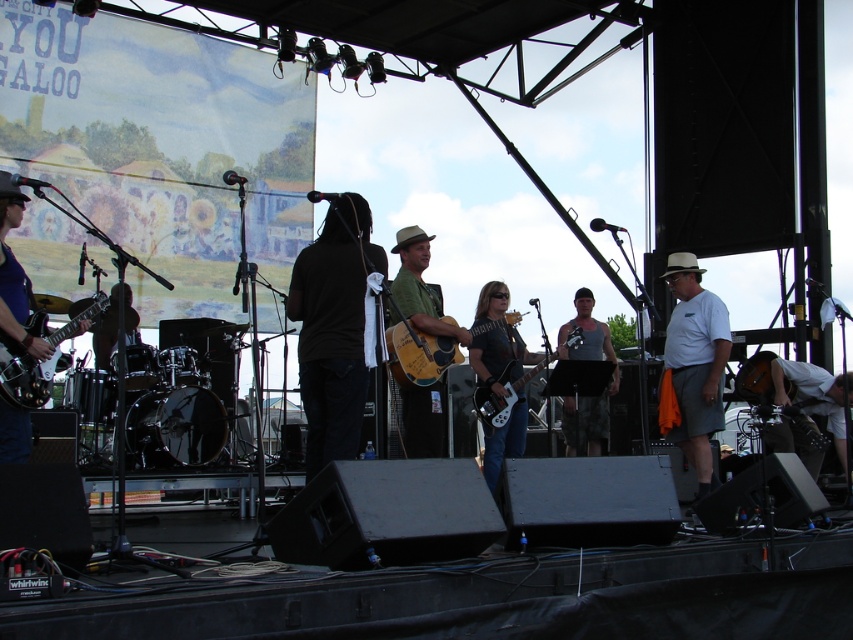
Between point (358, 392) and point (743, 390), which one is positioned in front?

Point (358, 392) is more forward.

Between black matte shirt at center and matte brown acoustic guitar at lower right, which one has more height?

black matte shirt at center

What do you see at coordinates (334, 330) in the screenshot? The width and height of the screenshot is (853, 640). I see `black matte shirt at center` at bounding box center [334, 330].

What are the coordinates of `black matte shirt at center` in the screenshot? It's located at (334, 330).

Between point (489, 435) and point (537, 368), which one is positioned in front?

Point (489, 435) is in front.

Is matte black guitar at center shorter than matte black electric guitar at center?

Incorrect, matte black guitar at center's height does not fall short of matte black electric guitar at center's.

Identify the location of matte black guitar at center. This screenshot has height=640, width=853. (498, 356).

Does black matte shirt at center have a larger size compared to matte black electric guitar at center?

Yes.

Looking at this image, can you confirm if black matte shirt at center is positioned to the right of matte black electric guitar at center?

In fact, black matte shirt at center is to the left of matte black electric guitar at center.

Find the location of a particular element. black matte shirt at center is located at coordinates (334, 330).